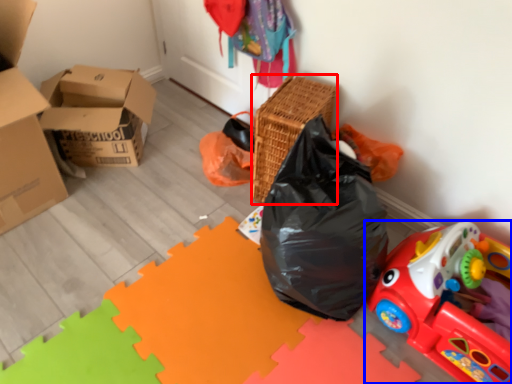
Question: Which of the following is the farthest to the observer, basket (highlighted by a red box) or toy (highlighted by a blue box)?

Choices:
 (A) basket
 (B) toy

Answer: (A)